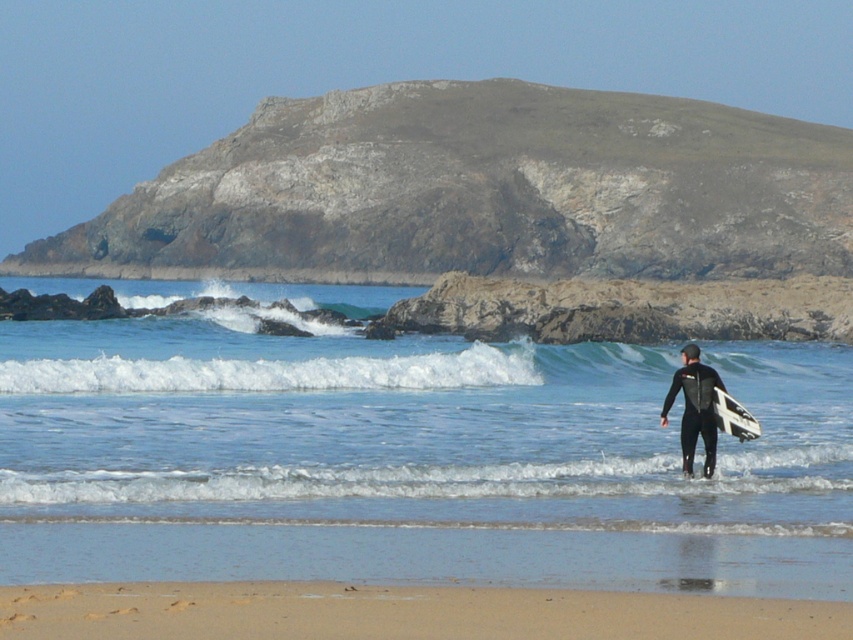
Question: Among these objects, which one is farthest from the camera?

Choices:
 (A) sandy beach at lower center
 (B) white matte surfboard at center-right

Answer: (B)

Question: Can you confirm if clear blue water at center is bigger than black wetsuit at center?

Choices:
 (A) yes
 (B) no

Answer: (A)

Question: Which point is farther from the camera taking this photo?

Choices:
 (A) [x=274, y=292]
 (B) [x=727, y=406]

Answer: (A)

Question: Among these objects, which one is nearest to the camera?

Choices:
 (A) white matte surfboard at center-right
 (B) sandy beach at lower center

Answer: (B)

Question: Is sandy beach at lower center closer to camera compared to white matte surfboard at center-right?

Choices:
 (A) yes
 (B) no

Answer: (A)

Question: Where is sandy beach at lower center located in relation to white matte surfboard at center-right in the image?

Choices:
 (A) above
 (B) below

Answer: (B)